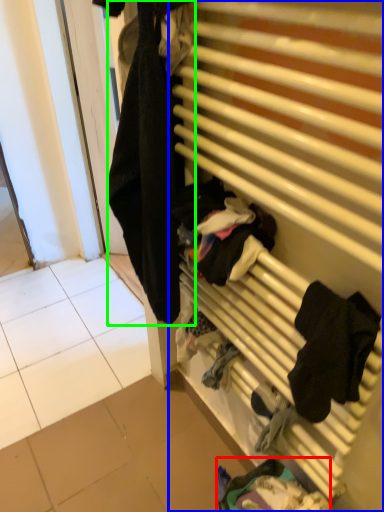
Question: Which object is positioned closest to clothing (highlighted by a red box)? Select from furniture (highlighted by a blue box) and clothing (highlighted by a green box).

Choices:
 (A) furniture
 (B) clothing

Answer: (A)